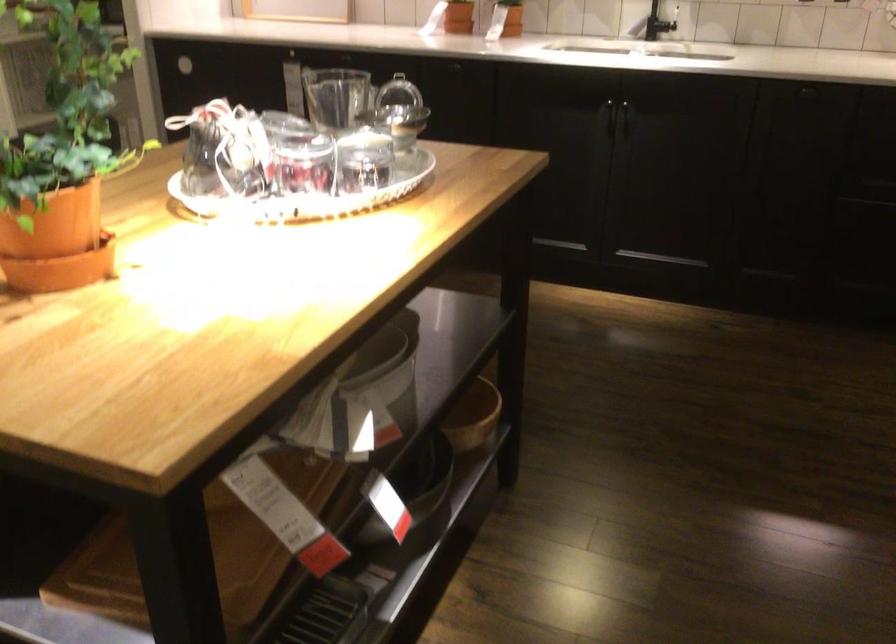
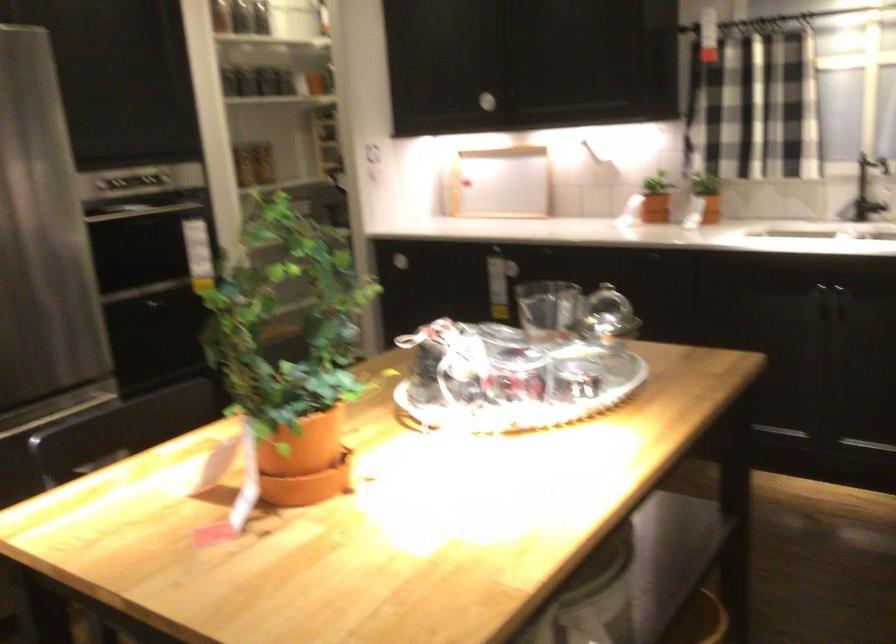
Which direction would the cameraman need to move to produce the second image?

The cameraman walked toward left, backward.